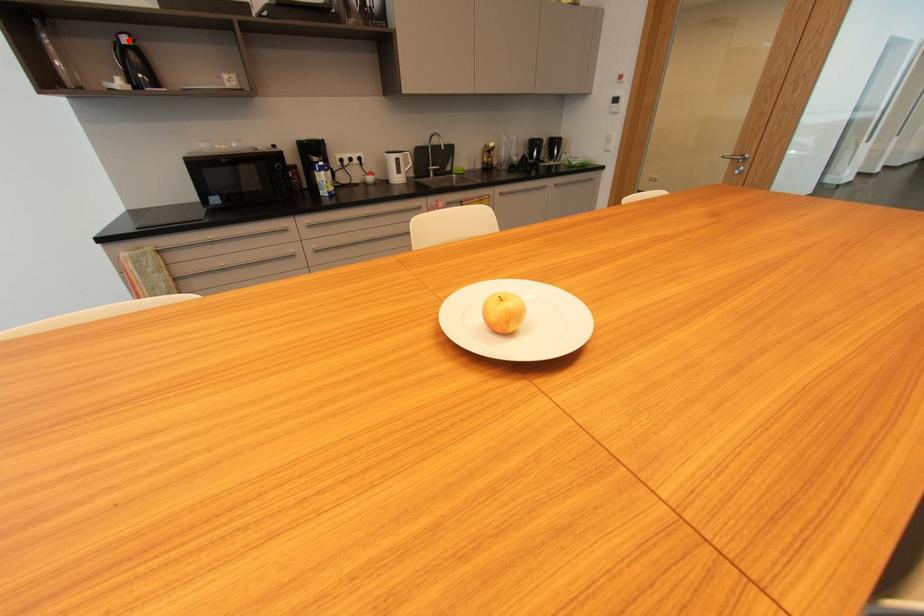
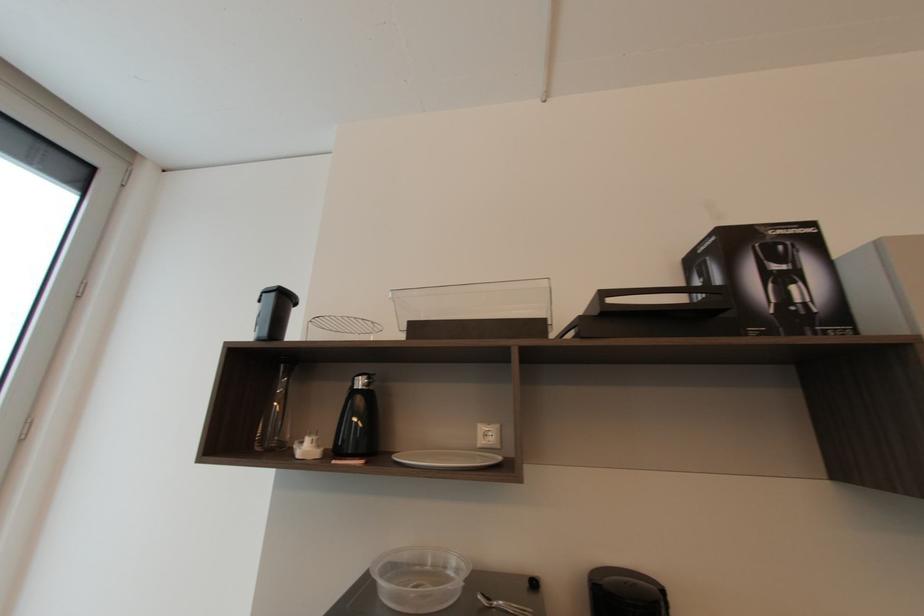
Find the pixel in the second image that matches the highlighted location in the first image.

(362, 384)